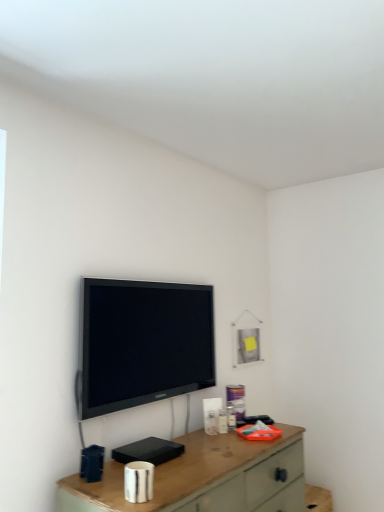
Question: In the image, is wooden desk at center on the left side or the right side of black glossy tv at upper center?

Choices:
 (A) right
 (B) left

Answer: (A)

Question: Looking at the image, does wooden desk at center seem bigger or smaller compared to black glossy tv at upper center?

Choices:
 (A) big
 (B) small

Answer: (A)

Question: In terms of height, does wooden desk at center look taller or shorter compared to black glossy tv at upper center?

Choices:
 (A) tall
 (B) short

Answer: (B)

Question: Visually, is black glossy tv at upper center positioned to the left or to the right of wooden desk at center?

Choices:
 (A) right
 (B) left

Answer: (B)

Question: Based on their sizes in the image, would you say black glossy tv at upper center is bigger or smaller than wooden desk at center?

Choices:
 (A) big
 (B) small

Answer: (B)

Question: From a real-world perspective, is black glossy tv at upper center positioned above or below wooden desk at center?

Choices:
 (A) above
 (B) below

Answer: (A)

Question: Is point (137, 380) positioned closer to the camera than point (289, 493)?

Choices:
 (A) closer
 (B) farther

Answer: (A)